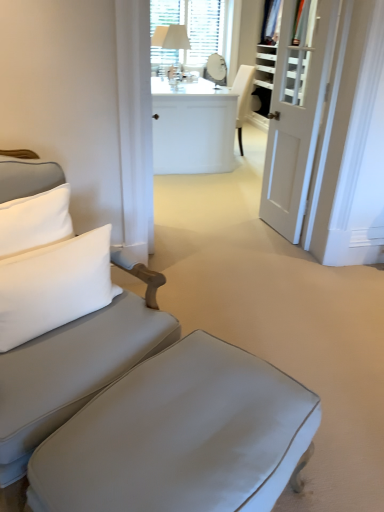
Find the location of a particular element. vacant region to the left of white glossy door at right is located at coordinates (241, 227).